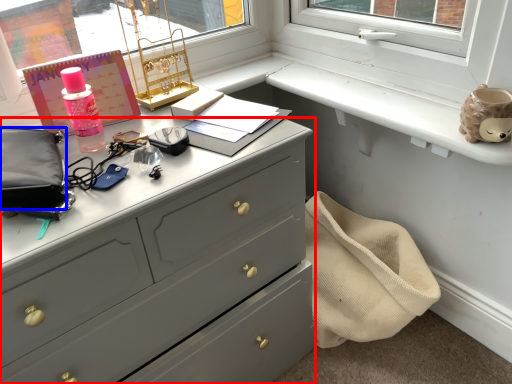
Question: Which point is further to the camera, chest of drawers (highlighted by a red box) or pouch (highlighted by a blue box)?

Choices:
 (A) chest of drawers
 (B) pouch

Answer: (B)